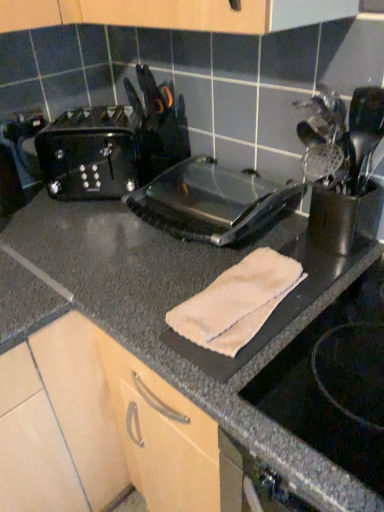
The height and width of the screenshot is (512, 384). I want to click on vacant region in front of black plastic toaster at left, so click(x=75, y=230).